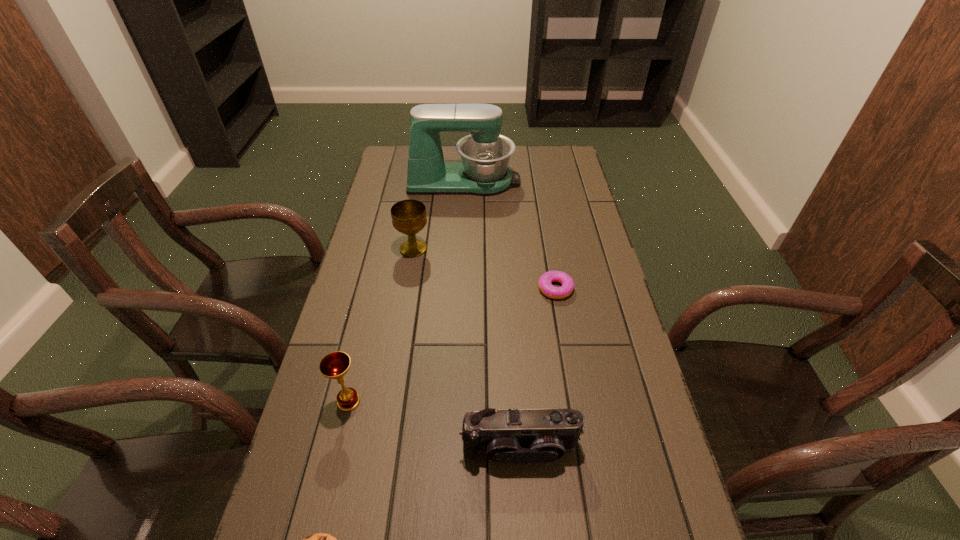
The image size is (960, 540). What are the coordinates of `the farthest object` in the screenshot? It's located at (485, 154).

Locate an element on the screen. mixer is located at coordinates (485, 154).

I want to click on the fifth nearest object, so click(x=409, y=217).

Locate an element on the screen. the farther chalice is located at coordinates (409, 217).

Find the location of a particular element. the fourth farthest object is located at coordinates (335, 365).

Identify the location of the left chalice. The width and height of the screenshot is (960, 540). (335, 365).

Where is `camcorder`? Image resolution: width=960 pixels, height=540 pixels. camcorder is located at coordinates (506, 435).

Locate an element on the screen. the second nearest object is located at coordinates (506, 435).

Image resolution: width=960 pixels, height=540 pixels. In order to click on the third farthest object in this screenshot , I will do `click(545, 286)`.

You are a GUI agent. You are given a task and a screenshot of the screen. Output one action in this format:
    pyautogui.click(x=<x>, y=<y>)
    Task: Click on the fifth tallest object
    This screenshot has height=540, width=960.
    Given the screenshot: What is the action you would take?
    pyautogui.click(x=545, y=286)